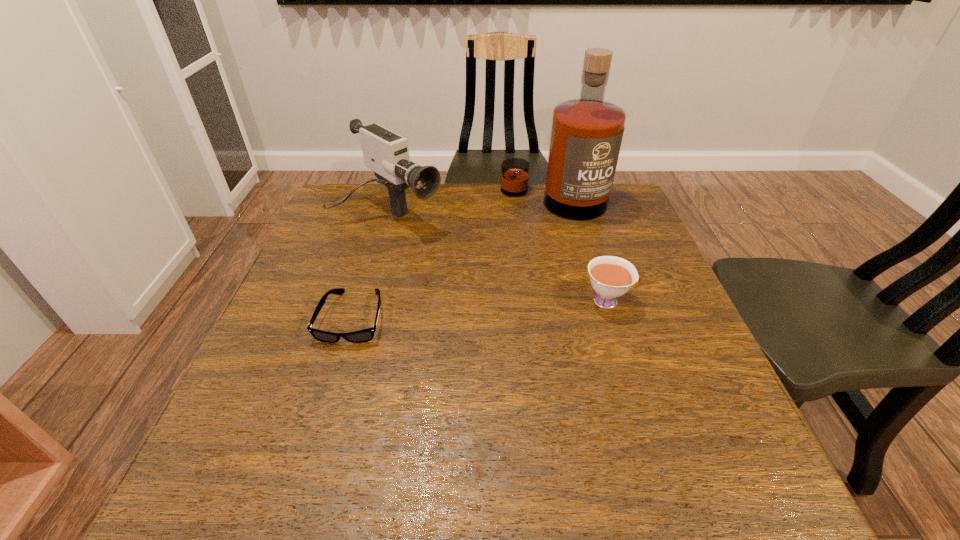
The width and height of the screenshot is (960, 540). I want to click on free space between the camcorder and the second shortest object, so click(x=498, y=258).

At what (x,y) coordinates should I click in order to perform the action: click on unoccupied position between the second tallest object and the sunglasses. Please return your answer as a coordinate pair (x, y). The image size is (960, 540). Looking at the image, I should click on (371, 266).

Where is `vacant space that's between the camcorder and the liquor`? vacant space that's between the camcorder and the liquor is located at coordinates (471, 208).

At what (x,y) coordinates should I click in order to perform the action: click on free space between the sunglasses and the third tallest object. Please return your answer as a coordinate pair (x, y). This screenshot has width=960, height=540. Looking at the image, I should click on (481, 309).

The image size is (960, 540). What are the coordinates of `empty location between the tallest object and the third tallest object` in the screenshot? It's located at (581, 251).

Identify the location of free space that is in between the teacup and the shortest object. This screenshot has height=540, width=960. (481, 309).

Identify the location of object that is the closest to the teacup. (586, 134).

Image resolution: width=960 pixels, height=540 pixels. I want to click on object that stands as the second closest to the second shortest object, so click(x=386, y=153).

This screenshot has height=540, width=960. Identify the location of vacant area in the image that satisfies the following two spatial constraints: 1. on the back side of the second tallest object; 2. on the left side of the tallest object. (393, 201).